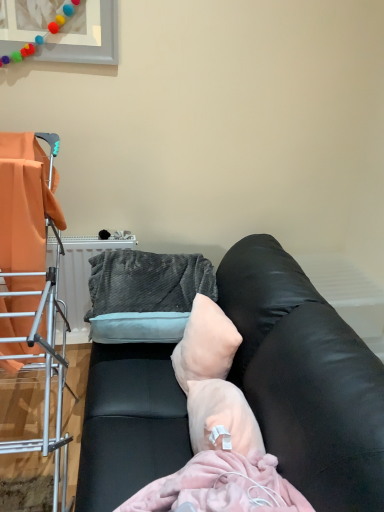
Question: Is pale pink fabric pillow at center to the right of metal drying rack at left from the viewer's perspective?

Choices:
 (A) no
 (B) yes

Answer: (B)

Question: From a real-world perspective, is pale pink fabric pillow at center beneath metal drying rack at left?

Choices:
 (A) yes
 (B) no

Answer: (A)

Question: Is pale pink fabric pillow at center further to camera compared to metal drying rack at left?

Choices:
 (A) no
 (B) yes

Answer: (B)

Question: Does pale pink fabric pillow at center have a greater width compared to metal drying rack at left?

Choices:
 (A) no
 (B) yes

Answer: (A)

Question: Considering the relative positions of pale pink fabric pillow at center and metal drying rack at left in the image provided, is pale pink fabric pillow at center to the left of metal drying rack at left from the viewer's perspective?

Choices:
 (A) yes
 (B) no

Answer: (B)

Question: Does pale pink fabric pillow at center have a lesser width compared to metal drying rack at left?

Choices:
 (A) no
 (B) yes

Answer: (B)

Question: Is metal drying rack at left outside black leather couch at center?

Choices:
 (A) no
 (B) yes

Answer: (B)

Question: Can you confirm if metal drying rack at left is shorter than black leather couch at center?

Choices:
 (A) no
 (B) yes

Answer: (A)

Question: Does metal drying rack at left appear on the left side of black leather couch at center?

Choices:
 (A) no
 (B) yes

Answer: (B)

Question: Is metal drying rack at left closer to camera compared to black leather couch at center?

Choices:
 (A) yes
 (B) no

Answer: (B)

Question: Is metal drying rack at left directly adjacent to black leather couch at center?

Choices:
 (A) yes
 (B) no

Answer: (B)

Question: From a real-world perspective, is metal drying rack at left on black leather couch at center?

Choices:
 (A) no
 (B) yes

Answer: (B)

Question: Can you confirm if metal drying rack at left is shorter than velvety gray bean bag chair at center?

Choices:
 (A) no
 (B) yes

Answer: (A)